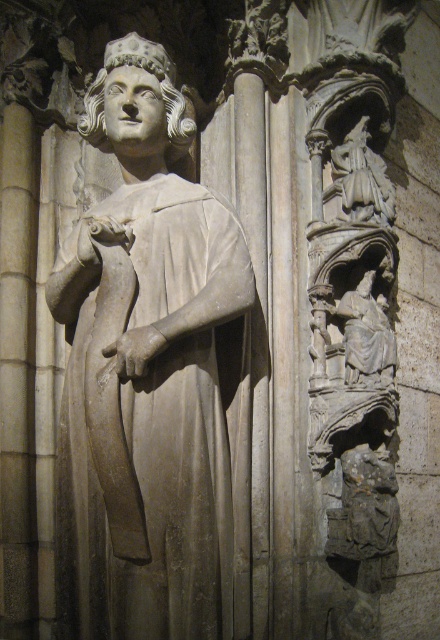
Question: Which object is positioned closest to the gray stone statue at center?

Choices:
 (A) gray stone statue at right
 (B) gray stone angel at upper right

Answer: (A)

Question: Considering the relative positions of gray stone statue at center and gray stone angel at upper right in the image provided, where is gray stone statue at center located with respect to gray stone angel at upper right?

Choices:
 (A) below
 (B) above

Answer: (A)

Question: Is gray stone statue at right positioned in front of gray stone angel at upper right?

Choices:
 (A) no
 (B) yes

Answer: (B)

Question: Estimate the real-world distances between objects in this image. Which object is farther from the gray stone statue at center?

Choices:
 (A) gray stone statue at right
 (B) gray stone angel at upper right

Answer: (B)

Question: Which object is closer to the camera taking this photo?

Choices:
 (A) gray stone statue at right
 (B) gray stone statue at center

Answer: (B)

Question: Is gray stone statue at center further to camera compared to gray stone statue at right?

Choices:
 (A) yes
 (B) no

Answer: (B)